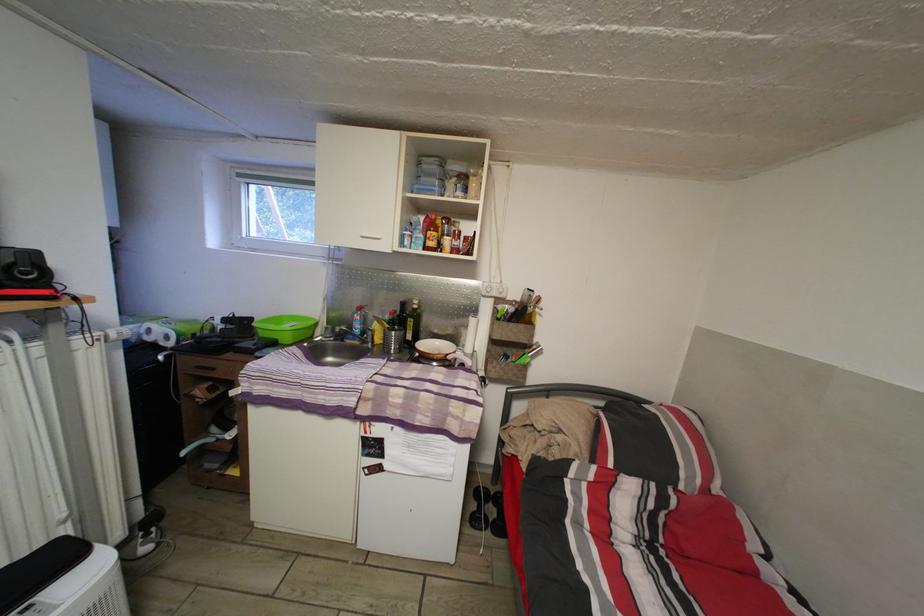
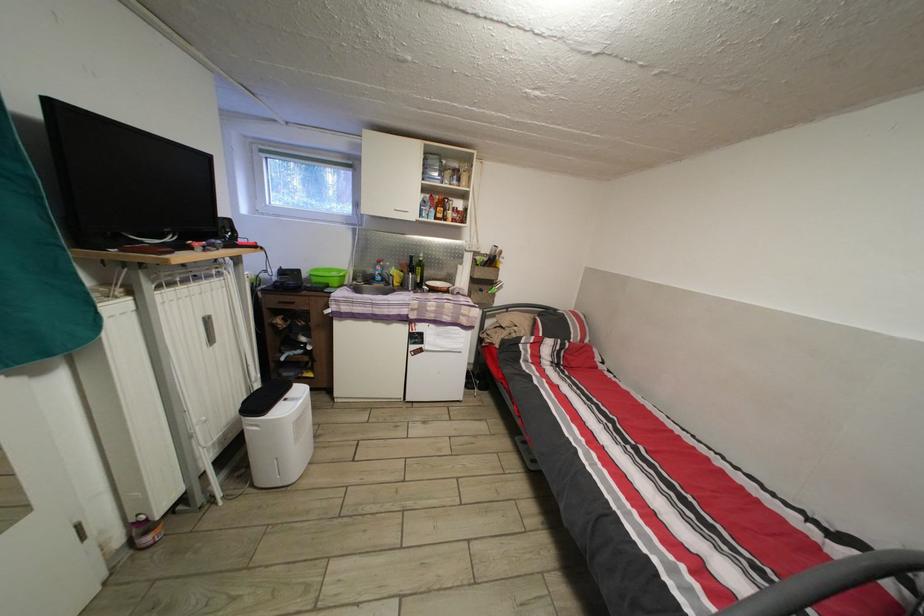
The images are taken continuously from a first-person perspective. In which direction are you moving?

The cameraman walked toward left, backward.